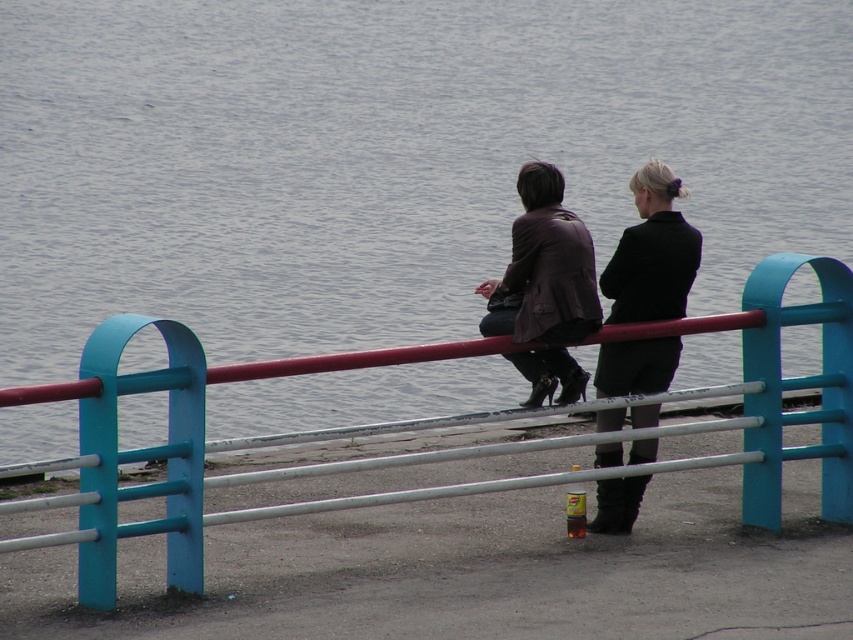
Question: Does gray water at upper center come behind black leather coat at center?

Choices:
 (A) no
 (B) yes

Answer: (A)

Question: Which of the following is the closest to the observer?

Choices:
 (A) (225, 476)
 (B) (608, 364)
 (C) (564, 4)
 (D) (547, 372)

Answer: (A)

Question: Can you confirm if teal plastic fence at lower center is positioned to the right of brown leather jacket at upper center?

Choices:
 (A) yes
 (B) no

Answer: (B)

Question: Which of the following is the farthest from the observer?

Choices:
 (A) gray water at upper center
 (B) brown leather jacket at upper center
 (C) teal plastic fence at lower center

Answer: (B)

Question: Does gray water at upper center appear on the right side of black leather coat at center?

Choices:
 (A) yes
 (B) no

Answer: (B)

Question: Which object appears closest to the camera in this image?

Choices:
 (A) black leather coat at center
 (B) brown leather jacket at upper center
 (C) gray water at upper center

Answer: (C)